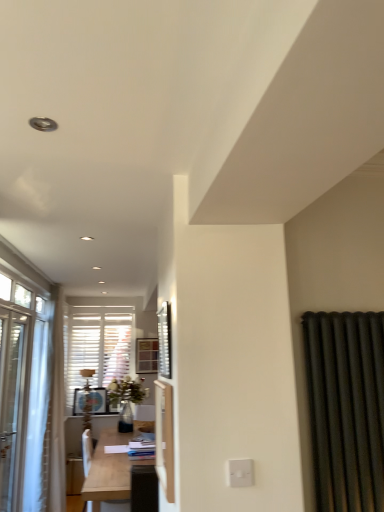
Question: In terms of width, does light wood table at center look wider or thinner when compared to metallic silver window screen at center?

Choices:
 (A) wide
 (B) thin

Answer: (A)

Question: From a real-world perspective, is light wood table at center above or below metallic silver window screen at center?

Choices:
 (A) above
 (B) below

Answer: (B)

Question: Which object is the farthest from the metallic silver window screen at center?

Choices:
 (A) white glossy screen door at center
 (B) white plastic switch at lower center
 (C) light wood table at center

Answer: (C)

Question: Estimate the real-world distances between objects in this image. Which object is closer to the metallic silver window screen at center?

Choices:
 (A) white glossy screen door at center
 (B) light wood table at center
 (C) white plastic switch at lower center

Answer: (A)